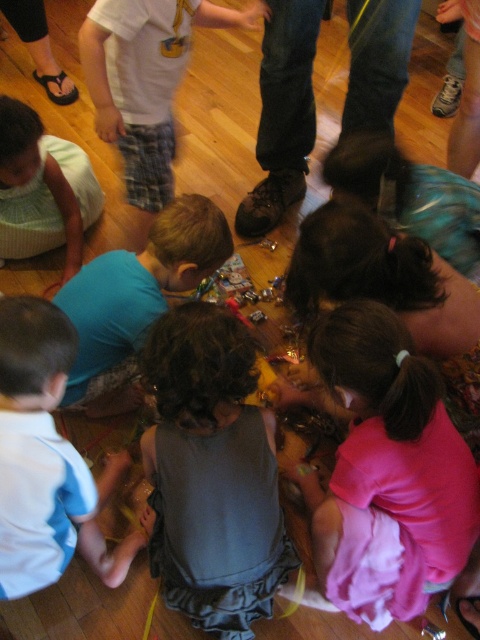
You are a teacher observing the children around the table. You need to place a small craft kit between the gray fabric dress at center and the pink fabric at lower center. Which fabric should you place it closer to so that it is closer to the taller object?

The gray fabric dress at center is taller than the pink fabric at lower center. Therefore, to place the craft kit closer to the taller object, you should position it closer to the gray fabric dress at center.

You are a child at the table and want to choose between the gray fabric dress at center and the white cotton shirt at lower left. Which one is smaller in size?

The gray fabric dress at center has a smaller size compared to the white cotton shirt at lower left, so the gray fabric dress at center is the smaller one.